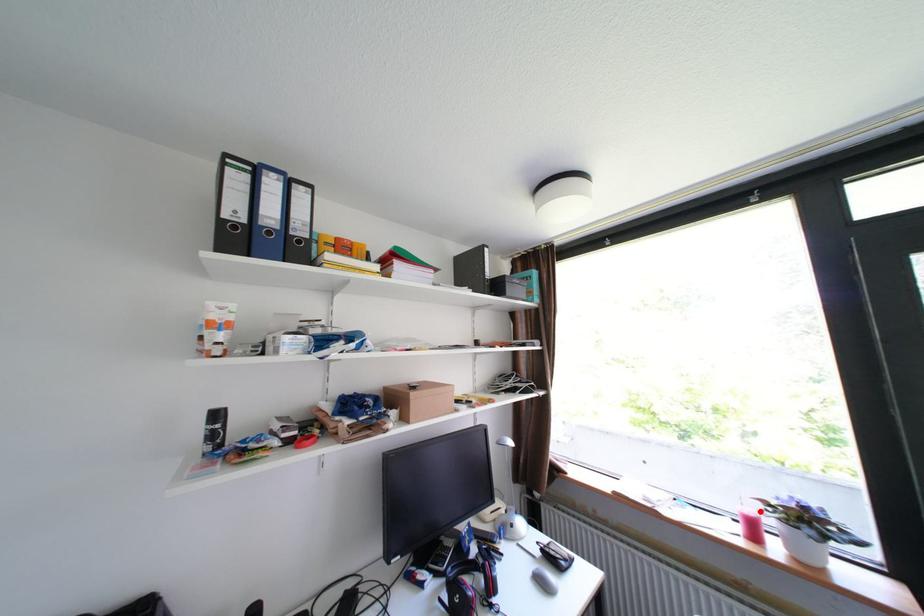
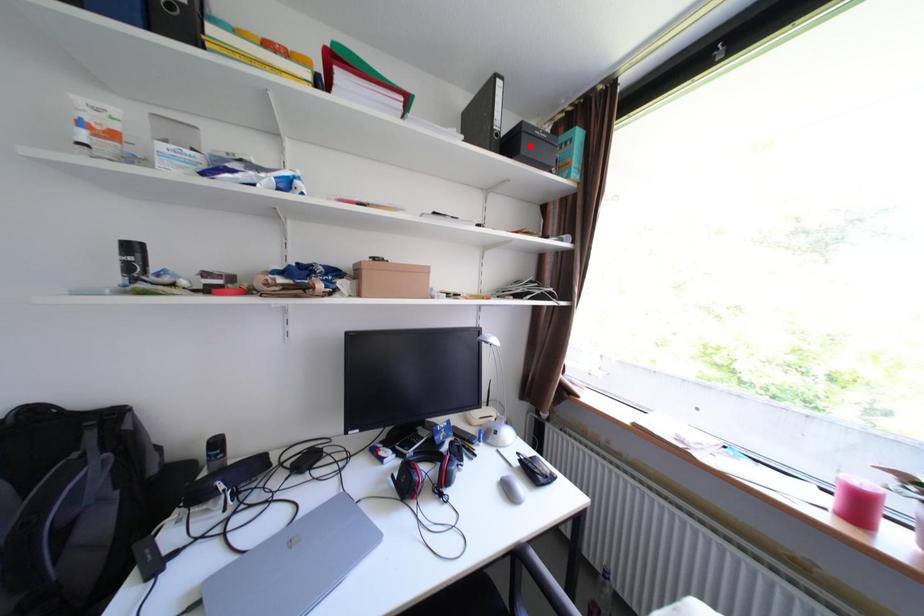
Looking at this image, I am providing you with two images of the same scene from different viewpoints. A red point is marked on the first image and another point is marked on the second image. Is the red point in image1 aligned with the point shown in image2?

No